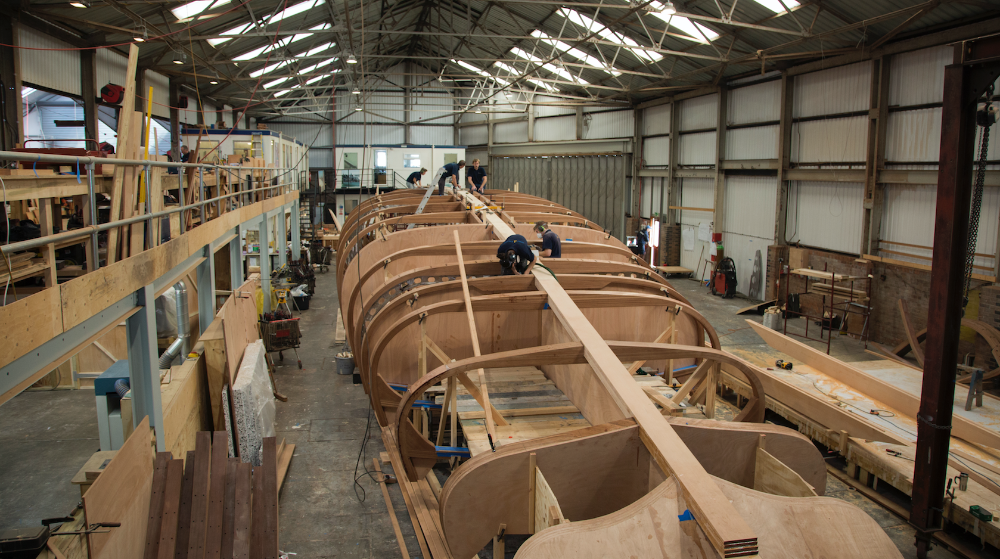
At what (x,y) coordinates should I click in order to perform the action: click on ceiling. Please return your answer as a coordinate pair (x, y). Looking at the image, I should click on (495, 46), (358, 32).